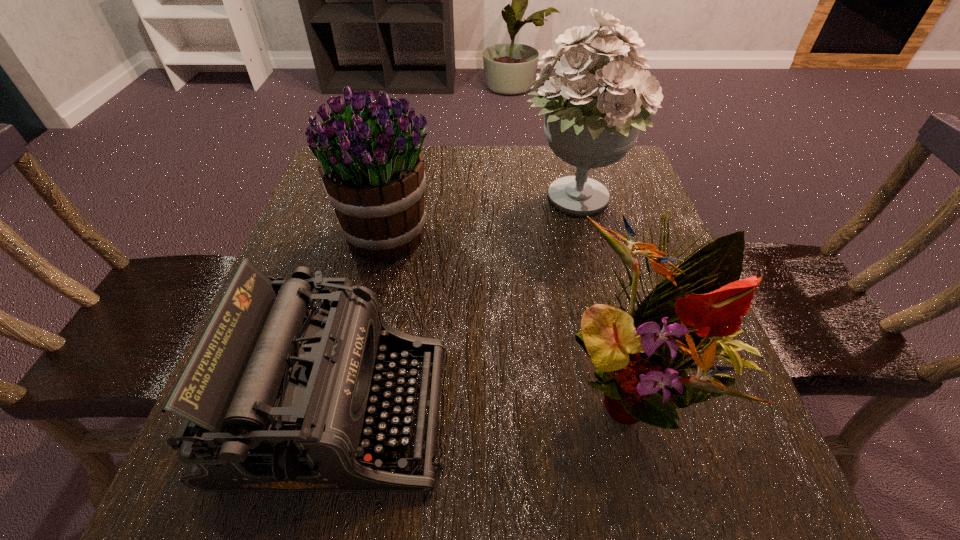
Image resolution: width=960 pixels, height=540 pixels. Find the location of `free spot between the shortest object and the tallest bouquet`. free spot between the shortest object and the tallest bouquet is located at coordinates (455, 306).

Find the location of a particular element. The height and width of the screenshot is (540, 960). free spot between the shortest object and the nearest bouquet is located at coordinates point(484,399).

The image size is (960, 540). What are the coordinates of `empty space between the leftmost bouquet and the tallest bouquet` in the screenshot? It's located at (481, 219).

In order to click on free space between the nearest bouquet and the tallest bouquet in this screenshot , I will do `click(603, 294)`.

This screenshot has width=960, height=540. In order to click on free space between the nearest bouquet and the leftmost bouquet in this screenshot , I will do `click(509, 311)`.

The image size is (960, 540). In order to click on free spot between the tallest object and the shortest object in this screenshot , I will do `click(455, 306)`.

Where is `vacant region between the leftmost bouquet and the nearest bouquet`? This screenshot has width=960, height=540. vacant region between the leftmost bouquet and the nearest bouquet is located at coordinates (509, 311).

Find the location of a particular element. The height and width of the screenshot is (540, 960). empty space between the nearest bouquet and the leftmost bouquet is located at coordinates (509, 311).

Identify which object is the nearest to the nearest bouquet. Please provide its 2D coordinates. Your answer should be formatted as a tuple, i.e. [(x, y)], where the tuple contains the x and y coordinates of a point satisfying the conditions above.

[(277, 396)]

At what (x,y) coordinates should I click in order to perform the action: click on object that is the second closest one to the tallest object. Please return your answer as a coordinate pair (x, y). Looking at the image, I should click on (692, 314).